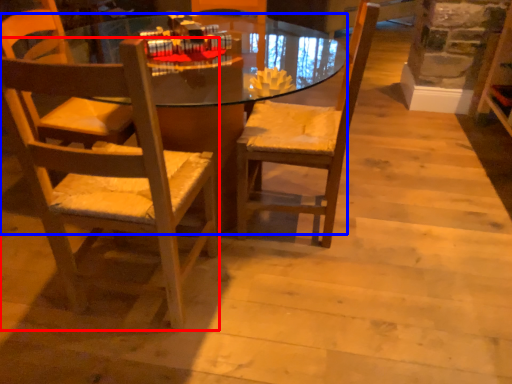
Question: Which object is closer to the camera taking this photo, chair (highlighted by a red box) or desk (highlighted by a blue box)?

Choices:
 (A) chair
 (B) desk

Answer: (A)